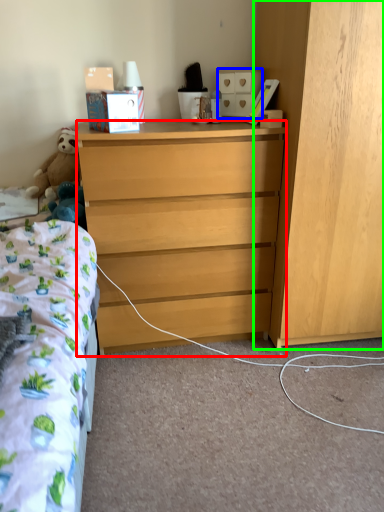
Question: Based on their relative distances, which object is nearer to desk (highlighted by a red box)? Choose from cabinetry (highlighted by a blue box) and cabinetry (highlighted by a green box).

Choices:
 (A) cabinetry
 (B) cabinetry

Answer: (B)